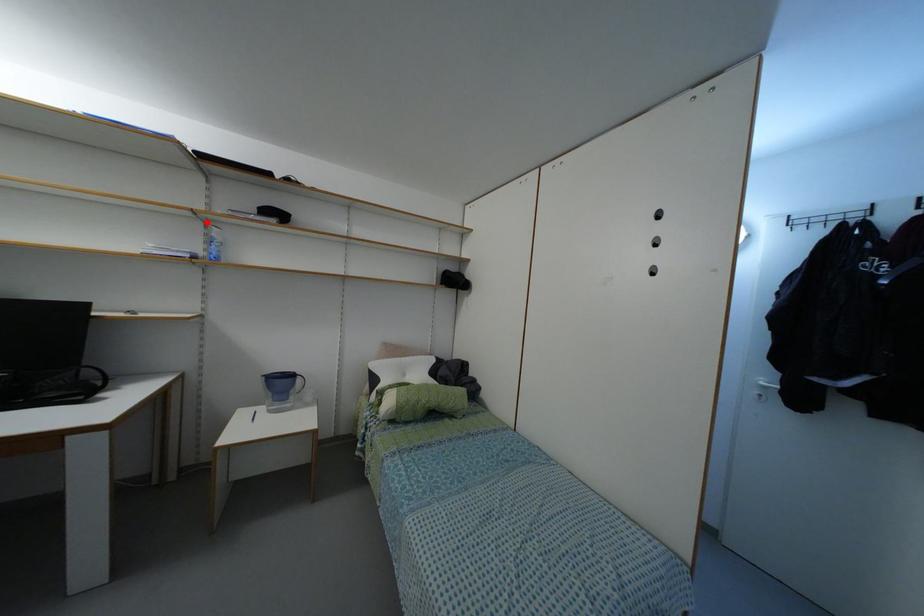
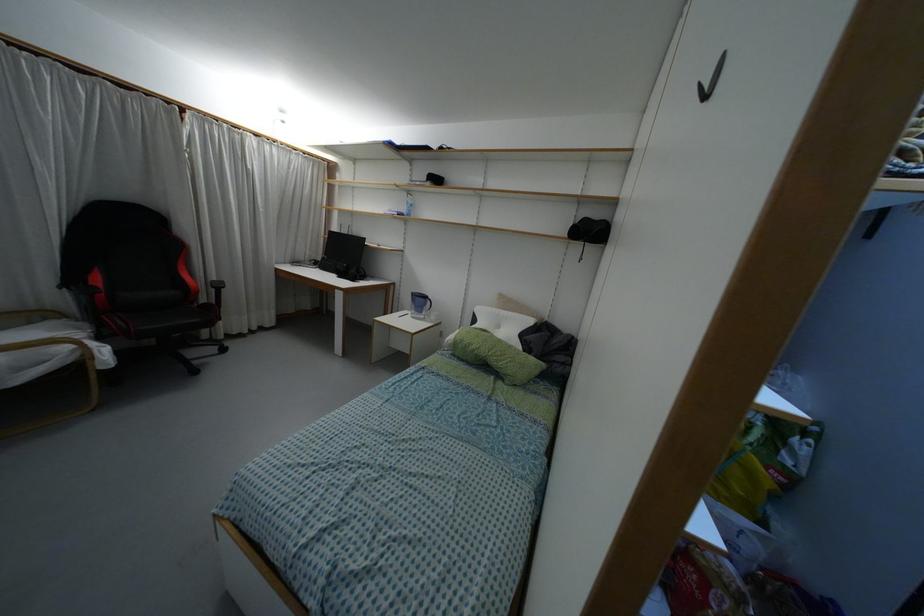
In the second image, find the point that corresponds to the highlighted location in the first image.

(407, 192)